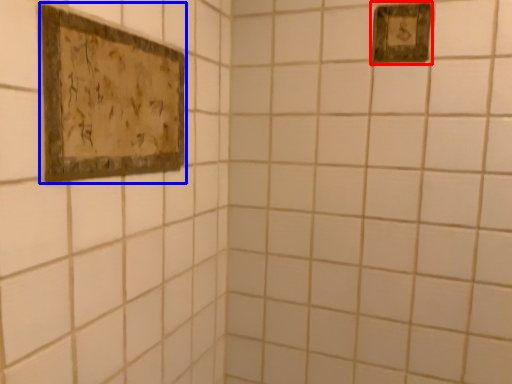
Question: Which object appears closest to the camera in this image, picture frame (highlighted by a red box) or picture frame (highlighted by a blue box)?

Choices:
 (A) picture frame
 (B) picture frame

Answer: (B)